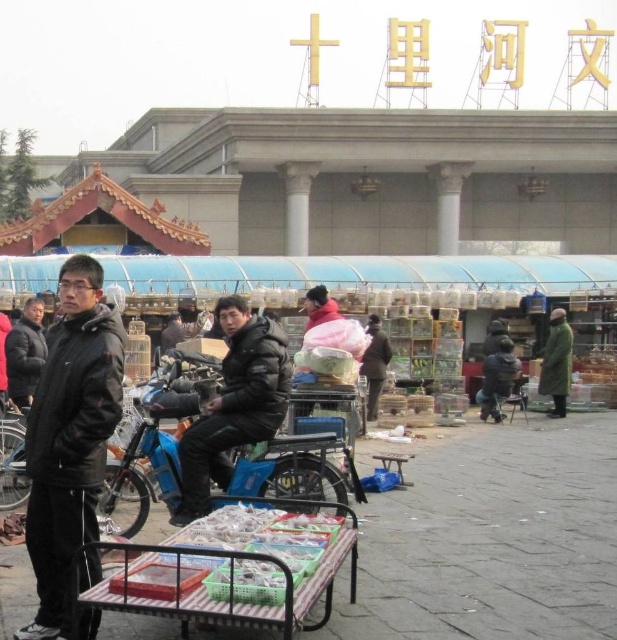
Question: Can you confirm if black leather jacket at left is positioned below translucent plastic tray at lower center?

Choices:
 (A) yes
 (B) no

Answer: (B)

Question: Is black matte jacket at center above translucent plastic tray at lower center?

Choices:
 (A) no
 (B) yes

Answer: (B)

Question: Which object appears closest to the camera in this image?

Choices:
 (A) black matte jacket at center
 (B) translucent plastic tray at lower center
 (C) black leather jacket at left

Answer: (B)

Question: Which of these objects is positioned closest to the green matte coat at right?

Choices:
 (A) translucent plastic tray at lower center
 (B) black leather jacket at left
 (C) black matte jacket at center
 (D) metallic silver cart at lower center

Answer: (C)

Question: Is black leather jacket at left below green matte coat at right?

Choices:
 (A) yes
 (B) no

Answer: (A)

Question: Estimate the real-world distances between objects in this image. Which object is farther from the translucent plastic tray at lower center?

Choices:
 (A) black leather jacket at left
 (B) green matte coat at right

Answer: (B)